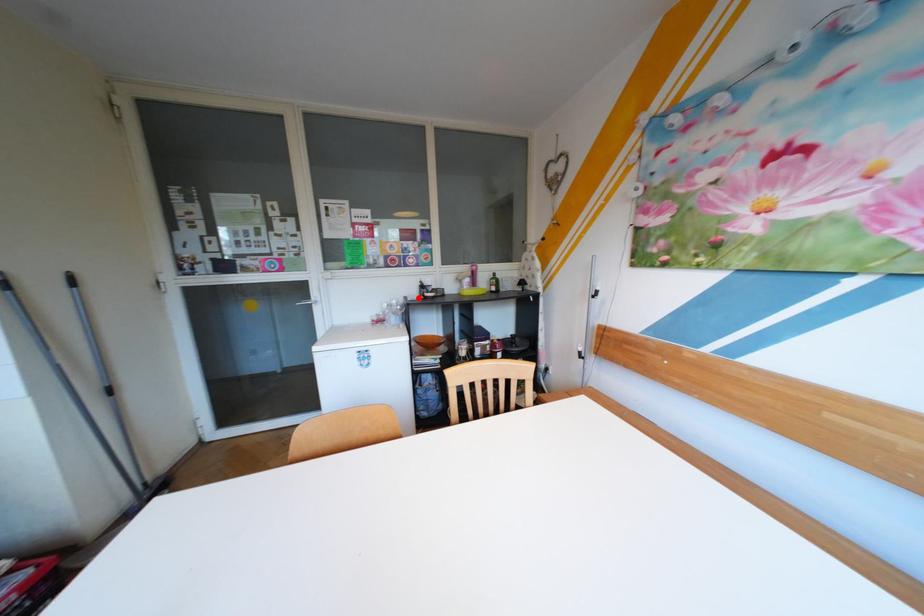
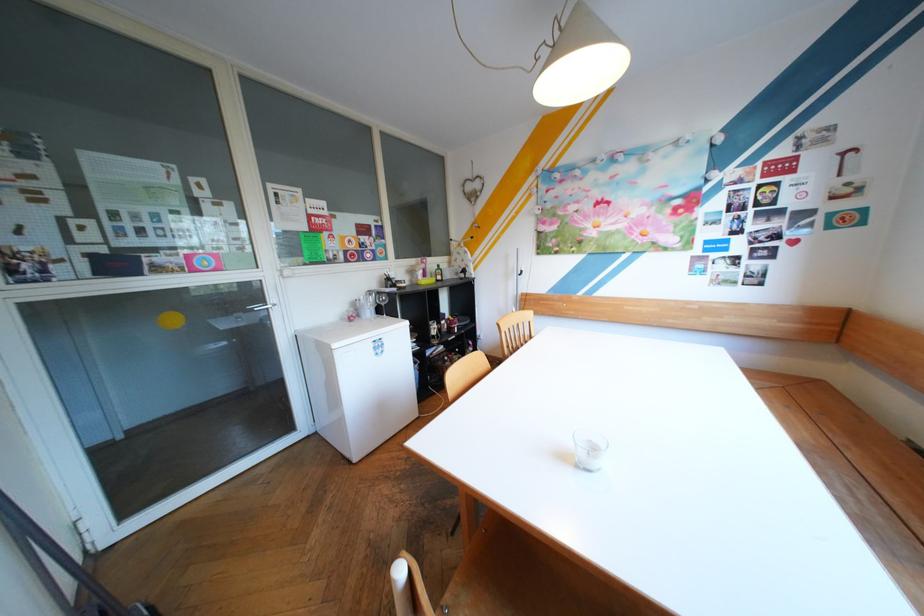
The point at the highlighted location is marked in the first image. Where is the corresponding point in the second image?

(383, 292)